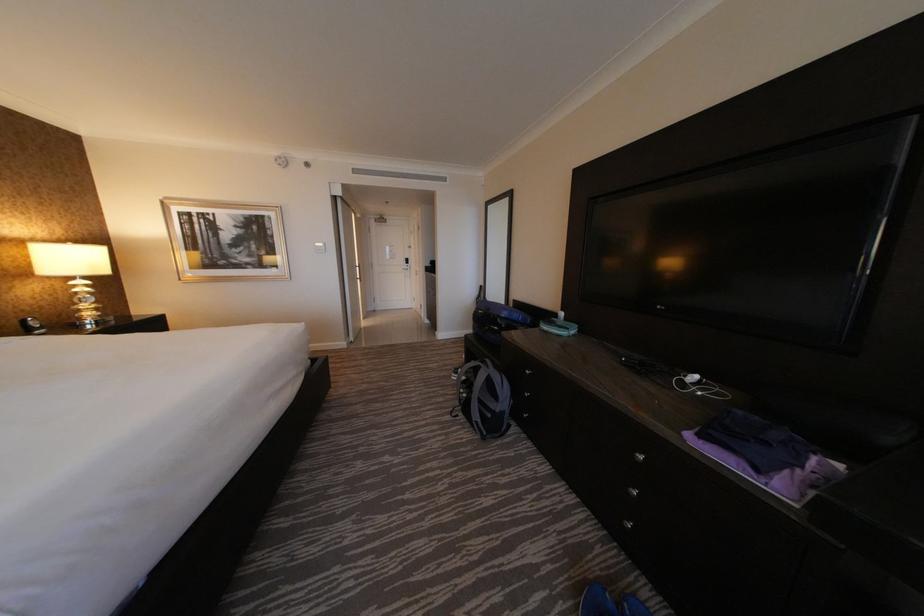
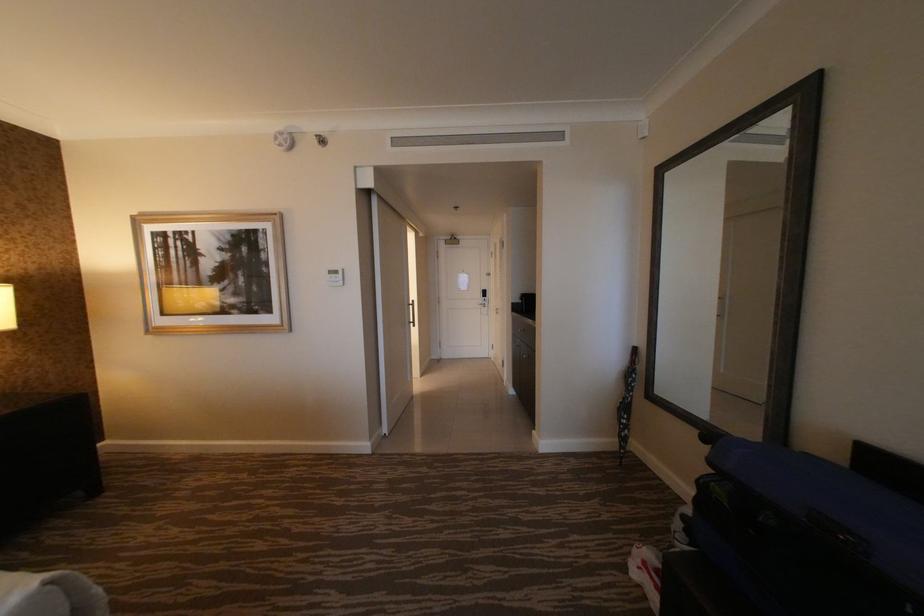
Question: The images are taken continuously from a first-person perspective. In which direction are you moving?

Choices:
 (A) Left
 (B) Right
 (C) Forward
 (D) Backward

Answer: (C)